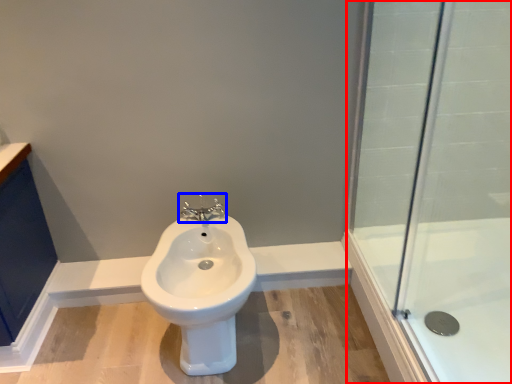
Question: Which object is closer to the camera taking this photo, shower door (highlighted by a red box) or tap (highlighted by a blue box)?

Choices:
 (A) shower door
 (B) tap

Answer: (A)